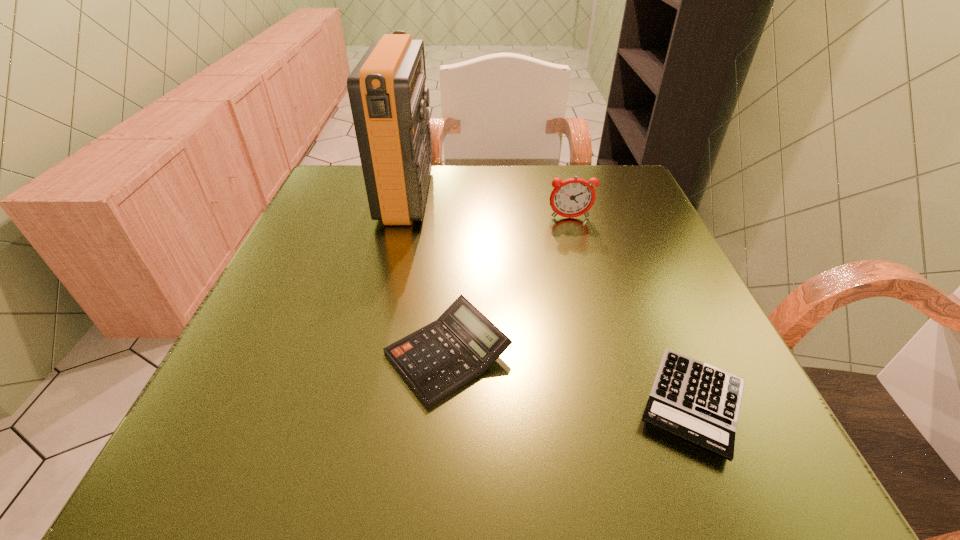
Where is `vacant space at the near edge of the desktop`? vacant space at the near edge of the desktop is located at coordinates (612, 447).

The width and height of the screenshot is (960, 540). In order to click on vacant space at the left edge of the desktop in this screenshot , I will do `click(333, 233)`.

The image size is (960, 540). I want to click on free region at the right edge, so point(625,294).

You are a GUI agent. You are given a task and a screenshot of the screen. Output one action in this format:
    pyautogui.click(x=<x>, y=<y>)
    Task: Click on the vacant area at the far left corner of the desktop
    
    Given the screenshot: What is the action you would take?
    pyautogui.click(x=353, y=174)

Locate an element on the screen. The image size is (960, 540). vacant space at the far right corner is located at coordinates (610, 190).

Locate an element on the screen. The image size is (960, 540). free area in between the third shortest object and the shorter calculator is located at coordinates (632, 310).

At what (x,y) coordinates should I click in order to perform the action: click on empty space between the radio receiver and the second shortest object. Please return your answer as a coordinate pair (x, y). The image size is (960, 540). Looking at the image, I should click on (427, 274).

Where is `free point between the shortest object and the radio receiver`? free point between the shortest object and the radio receiver is located at coordinates (550, 299).

At what (x,y) coordinates should I click in order to perform the action: click on vacant space that's between the radio receiver and the left calculator. Please return your answer as a coordinate pair (x, y). The image size is (960, 540). Looking at the image, I should click on (427, 274).

You are a GUI agent. You are given a task and a screenshot of the screen. Output one action in this format:
    pyautogui.click(x=<x>, y=<y>)
    Task: Click on the vacant point located between the right calculator and the left calculator
    This screenshot has height=540, width=960.
    Given the screenshot: What is the action you would take?
    pyautogui.click(x=571, y=379)